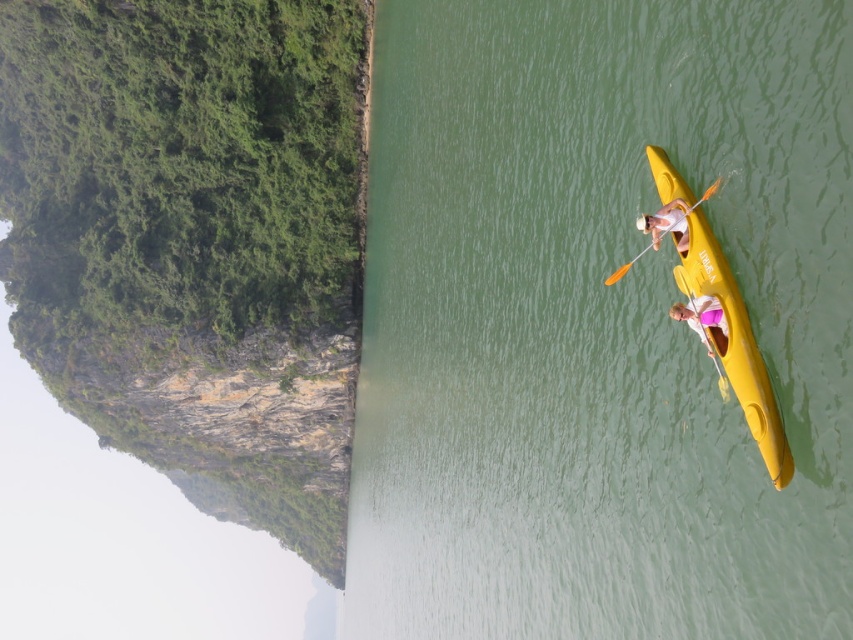
Can you confirm if yellow plastic kayak at right is shorter than yellow plastic paddle at upper right?

Incorrect, yellow plastic kayak at right's height does not fall short of yellow plastic paddle at upper right's.

Is point (788, 451) closer to viewer compared to point (692, 205)?

Yes, point (788, 451) is in front of point (692, 205).

What do you see at coordinates (735, 346) in the screenshot?
I see `yellow plastic kayak at right` at bounding box center [735, 346].

Locate an element on the screen. This screenshot has width=853, height=640. yellow plastic kayak at right is located at coordinates (735, 346).

Based on the photo, does yellow plastic kayak at right have a smaller size compared to white matte kayak at upper right?

No, yellow plastic kayak at right is not smaller than white matte kayak at upper right.

Who is more forward, (735, 380) or (677, 241)?

Point (735, 380) is in front.

Measure the distance between point (695, 278) and camera.

Point (695, 278) is 119.27 feet from camera.

I want to click on yellow plastic kayak at right, so click(735, 346).

How far apart are yellow plastic kayak at right and pink fabric at right?

yellow plastic kayak at right and pink fabric at right are 1.44 meters apart from each other.

Who is more forward, (779, 445) or (672, 316)?

Point (779, 445) is more forward.

This screenshot has height=640, width=853. I want to click on yellow plastic kayak at right, so click(x=735, y=346).